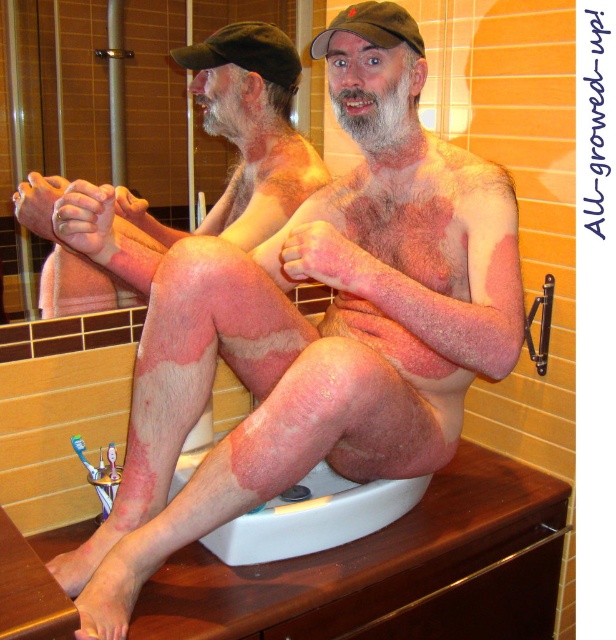
Question: Does smooth skin man at center have a lesser width compared to white plastic sink at lower center?

Choices:
 (A) no
 (B) yes

Answer: (A)

Question: Does smooth skin man at center lie in front of white plastic sink at lower center?

Choices:
 (A) yes
 (B) no

Answer: (A)

Question: Is smooth skin man at center to the right of white plastic sink at lower center from the viewer's perspective?

Choices:
 (A) yes
 (B) no

Answer: (B)

Question: Which point appears farthest from the camera in this image?

Choices:
 (A) (237, 60)
 (B) (375, 525)

Answer: (A)

Question: Which object appears closest to the camera in this image?

Choices:
 (A) white plastic sink at lower center
 (B) smooth skin man at center

Answer: (B)